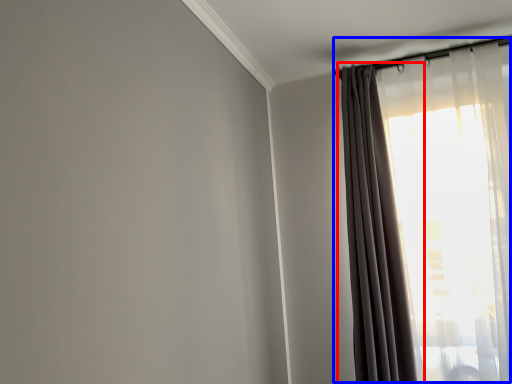
Question: Which object appears farthest to the camera in this image, curtain (highlighted by a red box) or curtain (highlighted by a blue box)?

Choices:
 (A) curtain
 (B) curtain

Answer: (B)